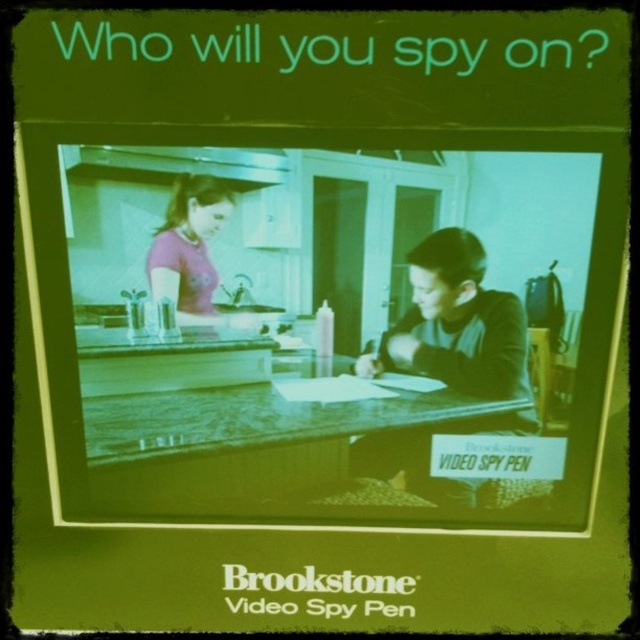
You are a detective trying to gather evidence in the scene. You need to determine the spatial relationship between the matte black shirt at center and the matte plastic counter top at center. Based on the scene, which object is closer to you?

The matte plastic counter top at center is closer to you because the matte black shirt at center is positioned behind it.

You are a detective trying to determine which suspect is closer to the camera based on their clothing. You observe the matte black shirt at center and the matte purple shirt at upper left. Which shirt appears larger in the image?

The matte black shirt at center appears larger than the matte purple shirt at upper left because it is bigger in size.

You are standing 5 feet away from the point at coordinates point (x=499, y=355). Can you reach it without moving your feet?

The distance of point (x=499, y=355) from camera is 4.18 feet. Since you are standing 5 feet away from it, you are farther than the point. Therefore, you cannot reach it without moving your feet.